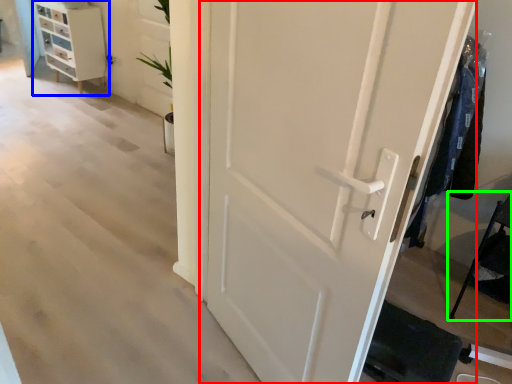
Question: Based on their relative distances, which object is farther from door (highlighted by a red box)? Choose from chest of drawers (highlighted by a blue box) and furniture (highlighted by a green box).

Choices:
 (A) chest of drawers
 (B) furniture

Answer: (A)